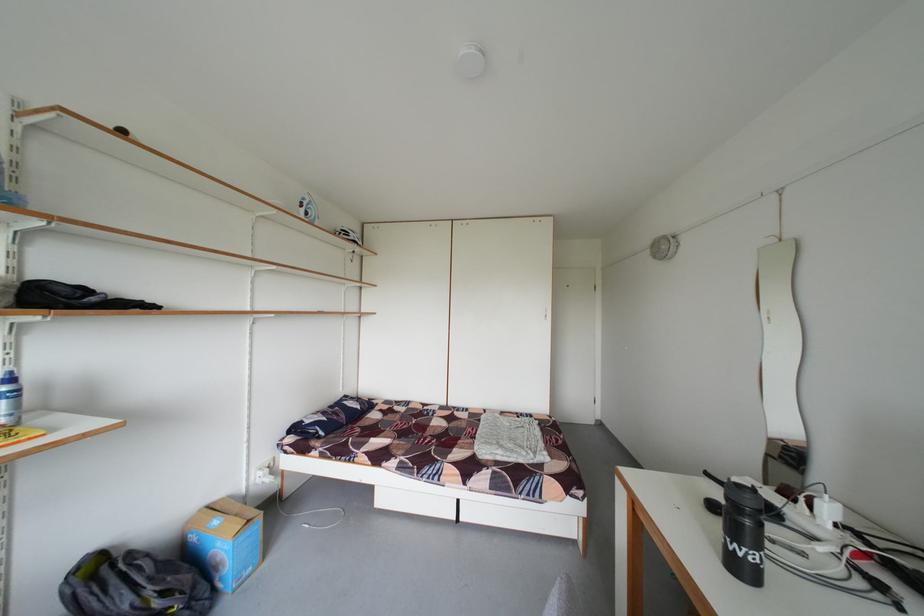
At what (x,y) coordinates should I click in order to perform the action: click on white bicycle helmet. Please return your answer as a coordinate pair (x, y). The image size is (924, 616). Looking at the image, I should click on (307, 208).